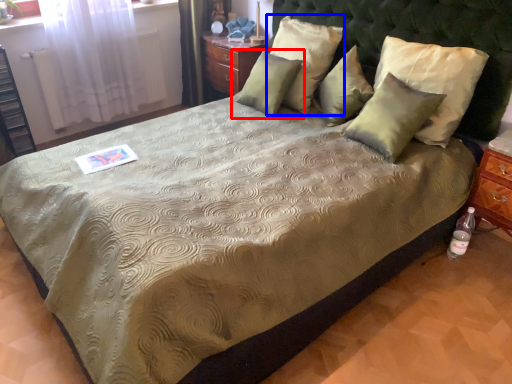
Question: Among these objects, which one is nearest to the camera, pillow (highlighted by a red box) or pillow (highlighted by a blue box)?

Choices:
 (A) pillow
 (B) pillow

Answer: (B)